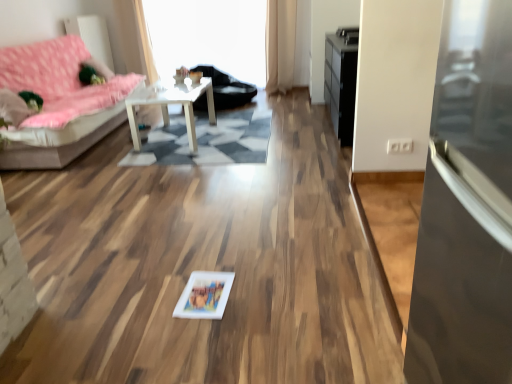
What are the coordinates of `vacant area to the right of white glossy picture frame at center` in the screenshot? It's located at (255, 291).